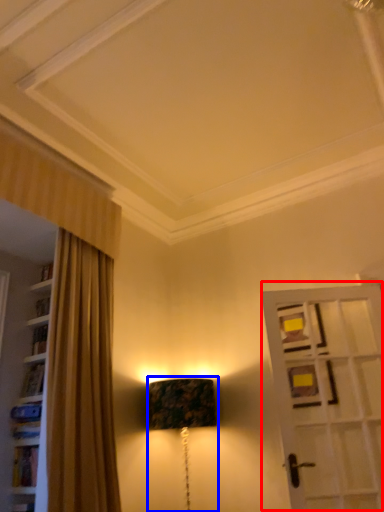
Question: Which point is further to the camera, door (highlighted by a red box) or table lamp (highlighted by a blue box)?

Choices:
 (A) door
 (B) table lamp

Answer: (B)